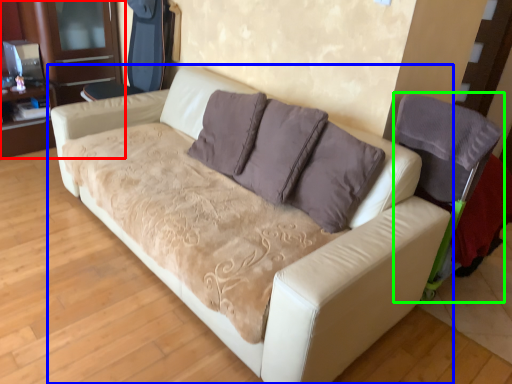
Question: Which object is the farthest from dresser (highlighted by a red box)? Choose among these: studio couch (highlighted by a blue box) or armchair (highlighted by a green box).

Choices:
 (A) studio couch
 (B) armchair

Answer: (B)